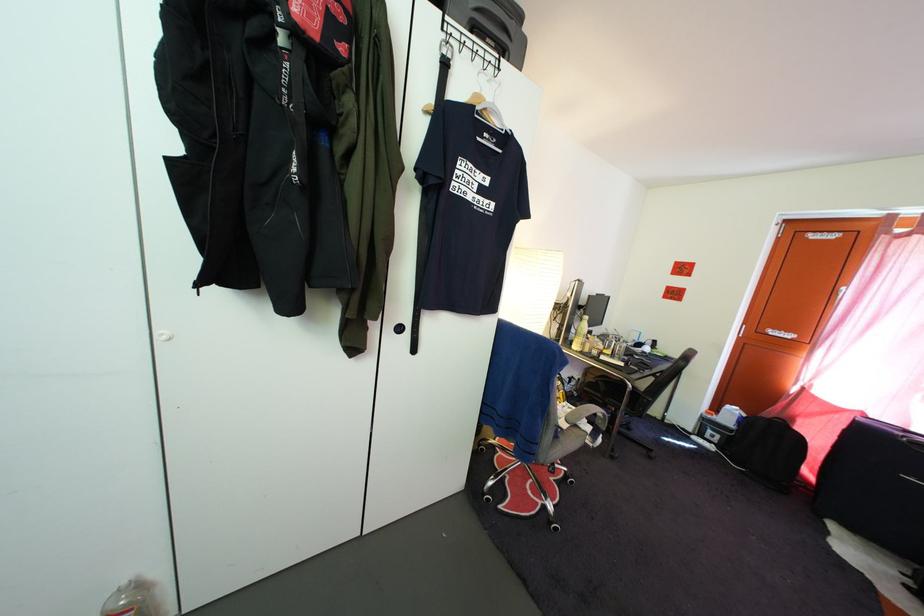
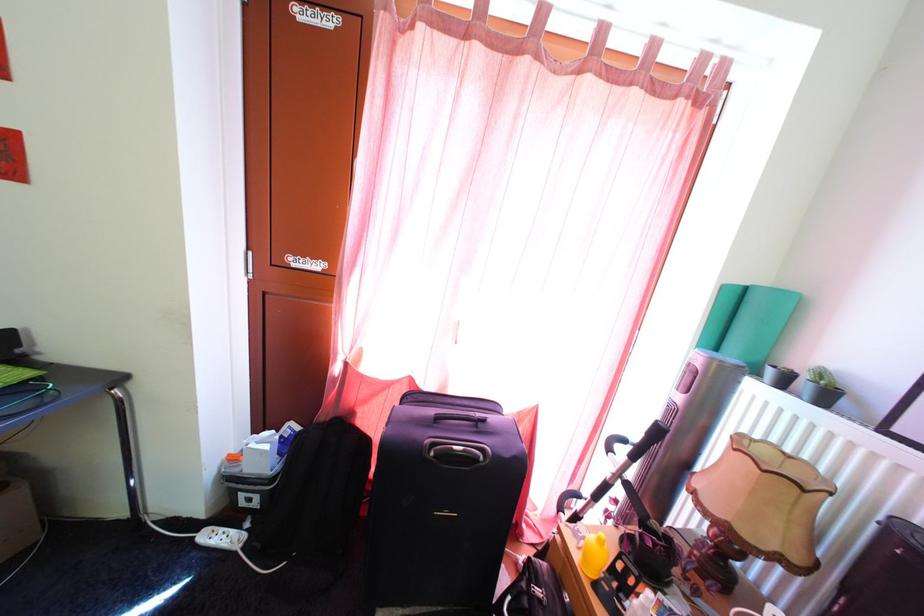
Where in the second image is the point corresponding to pixel 723 448 from the first image?

(264, 512)